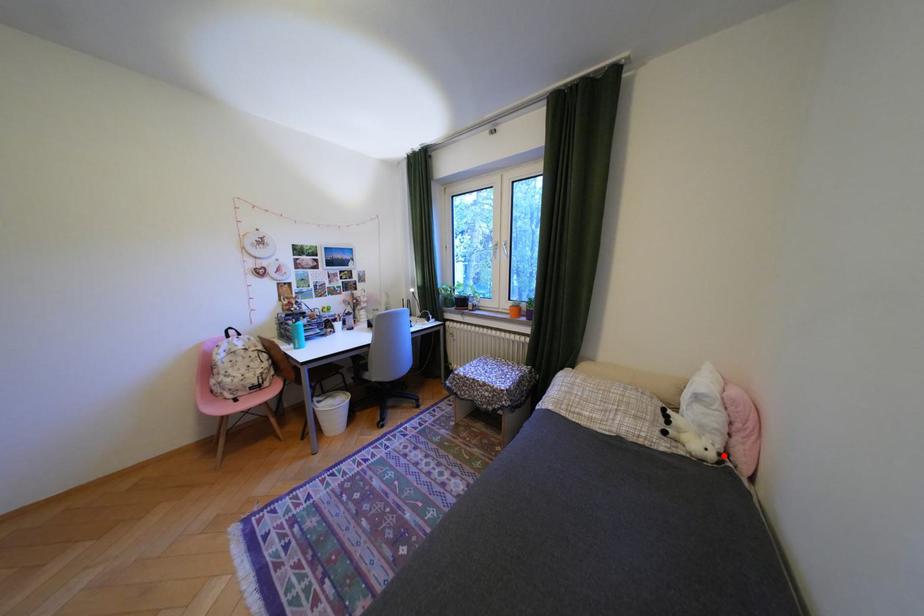
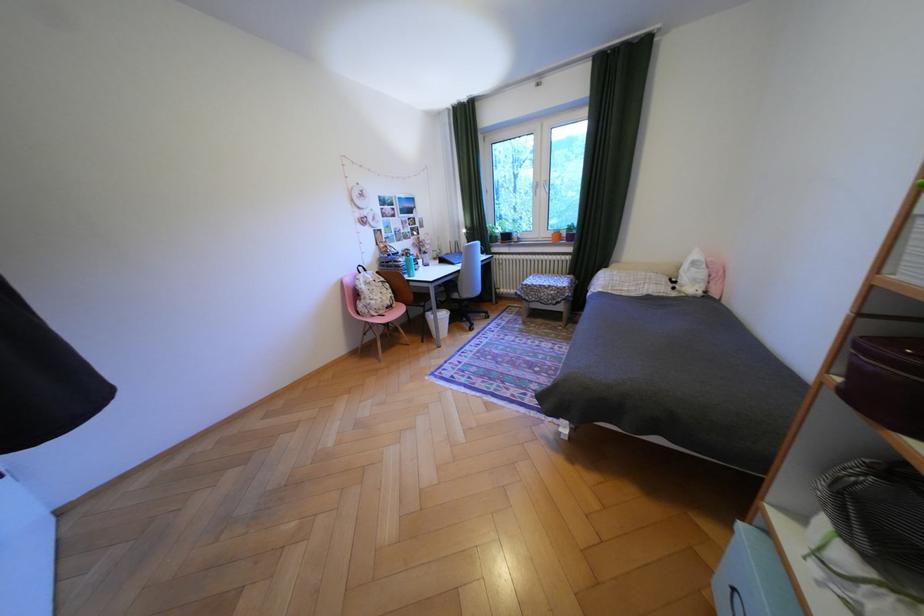
The point at the highlighted location is marked in the first image. Where is the corresponding point in the second image?

(712, 293)